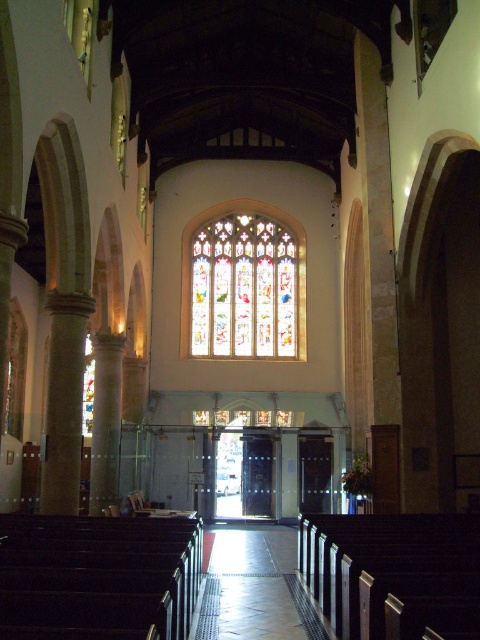
You are standing at the entrance of the grand church and want to walk straight to the altar. There is a shiny metallic aisle at center in front of you. Is the stained glass window at center above the aisle or behind it?

The stained glass window at center is positioned over the shiny metallic aisle at center, so it is above the aisle.

You are standing at the entrance of the grand church and notice the stained glass window at center and the shiny metallic aisle at center. Which object is taller?

The stained glass window at center is taller than the shiny metallic aisle at center.

You are standing at the entrance of the grand church and want to locate the stained glass window at center. Based on its coordinates, in which direction should you look to find it?

The stained glass window at center is located at coordinates point (x=243, y=284), so you should look towards the center of the back wall to find it.